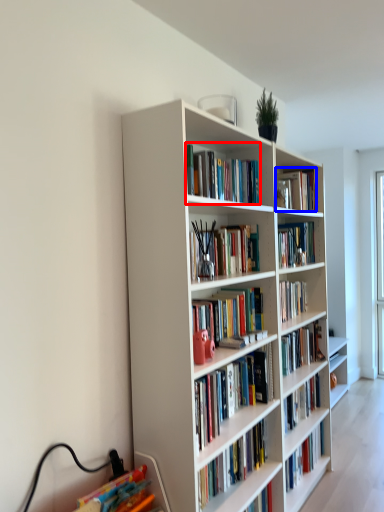
Question: Which object is further to the camera taking this photo, book (highlighted by a red box) or book (highlighted by a blue box)?

Choices:
 (A) book
 (B) book

Answer: (B)